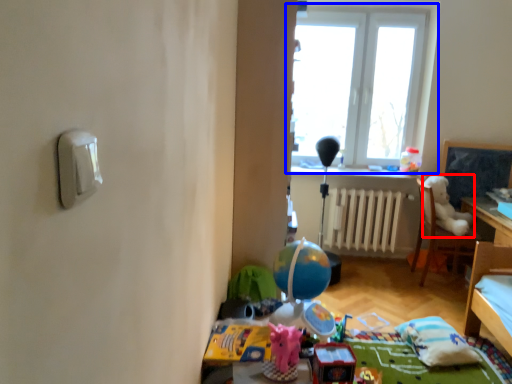
Question: Which object appears closest to the camera in this image, animal (highlighted by a red box) or window (highlighted by a blue box)?

Choices:
 (A) animal
 (B) window

Answer: (A)